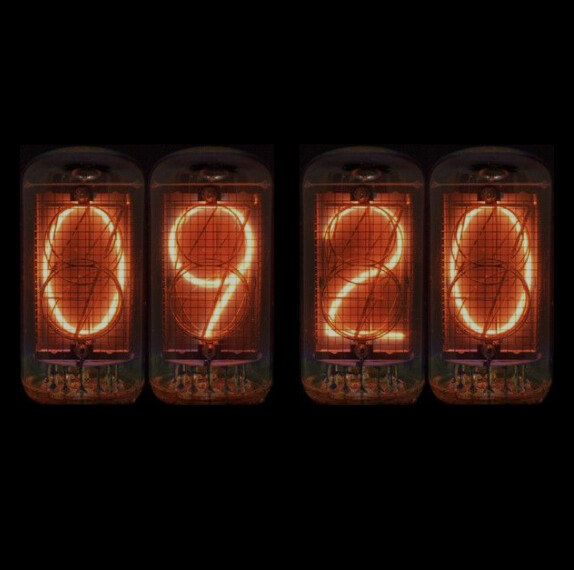
Where is `cover`? cover is located at coordinates (88, 268), (197, 260), (362, 271), (501, 282).